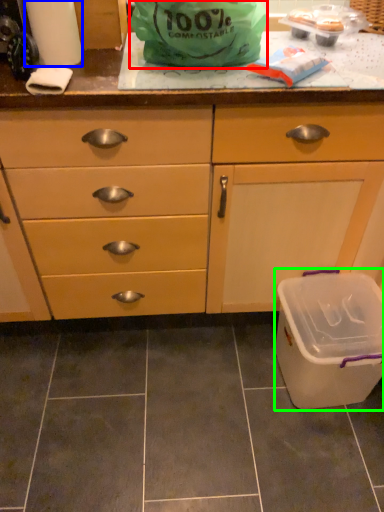
Question: Which object is the closest to the plastic bag (highlighted by a red box)? Choose among these: paper towel (highlighted by a blue box) or recycling bin (highlighted by a green box).

Choices:
 (A) paper towel
 (B) recycling bin

Answer: (A)